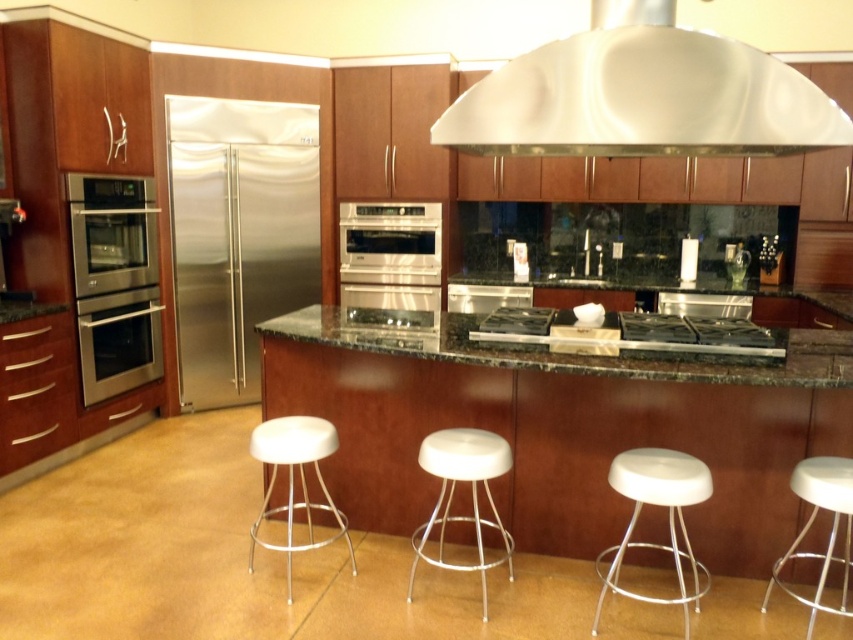
Which is behind, point (378, 262) or point (416, 531)?

Positioned behind is point (378, 262).

Does stainless steel oven at center have a smaller size compared to white plastic stool at center?

Correct, stainless steel oven at center occupies less space than white plastic stool at center.

Identify the location of stainless steel oven at center. This screenshot has height=640, width=853. (392, 262).

This screenshot has width=853, height=640. Identify the location of stainless steel oven at center. (392, 262).

In the scene shown: Who is positioned more to the left, white plastic stool at center or white plastic bar stool at lower right?

From the viewer's perspective, white plastic stool at center appears more on the left side.

Is white plastic stool at center below white plastic bar stool at lower right?

No, white plastic stool at center is not below white plastic bar stool at lower right.

Is point (453, 490) positioned after point (810, 483)?

Yes.

Locate an element on the screen. white plastic stool at center is located at coordinates 471,493.

Does stainless steel oven at center appear over white plastic stool at lower right?

Indeed, stainless steel oven at center is positioned over white plastic stool at lower right.

Is point (438, 296) closer to camera compared to point (614, 577)?

No, it is not.

Find the location of a particular element. Image resolution: width=853 pixels, height=640 pixels. stainless steel oven at center is located at coordinates (392, 262).